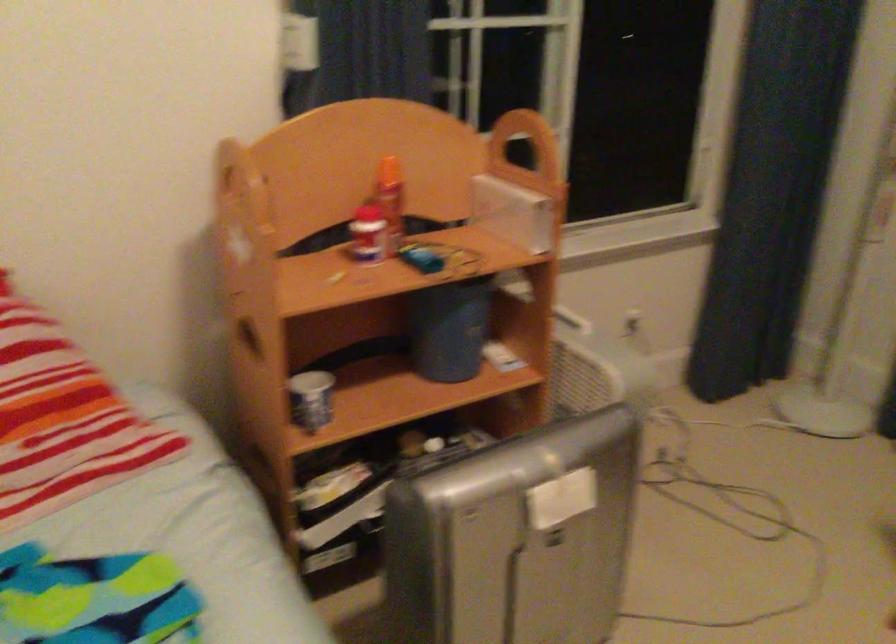
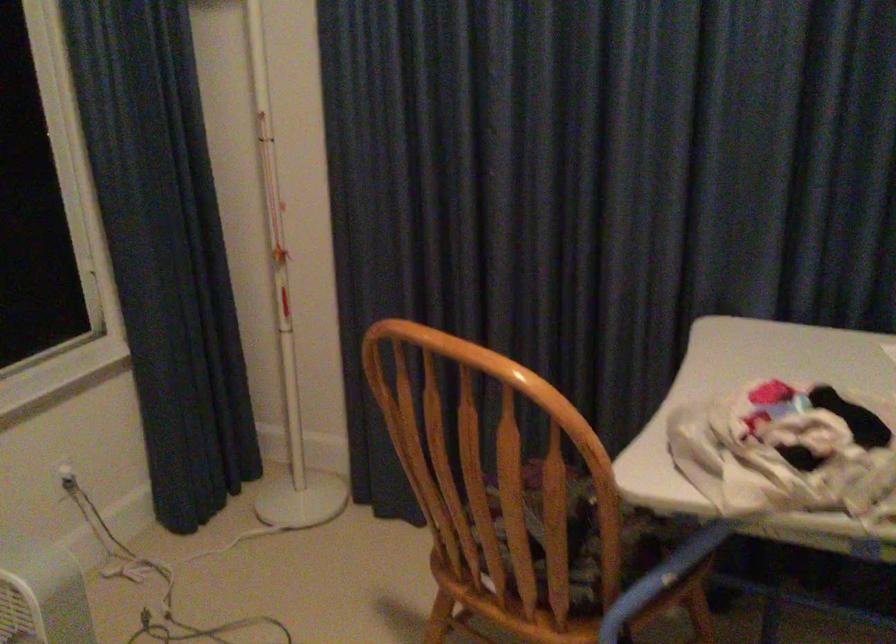
In the second image, find the point that corresponds to pixel 695 430 in the first image.

(164, 581)